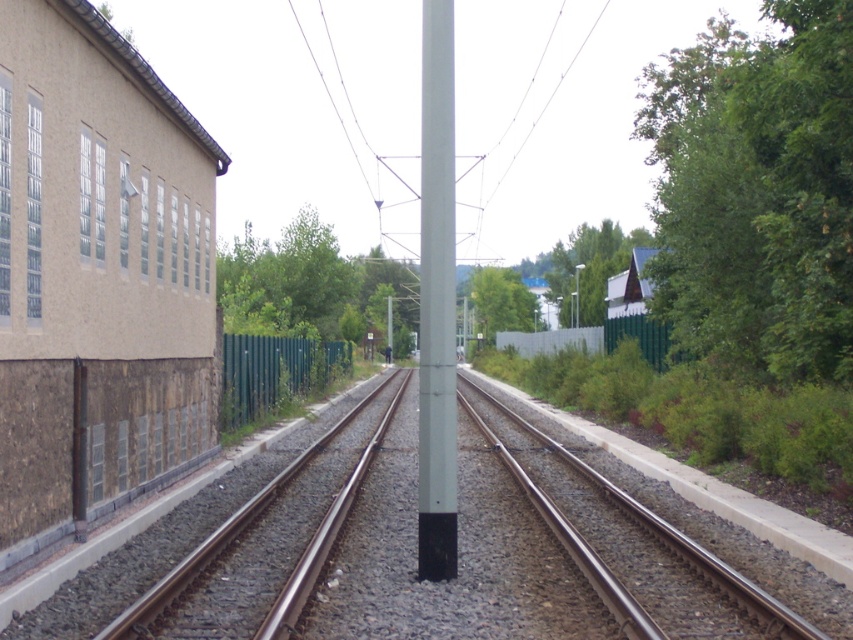
Is green leafy tree at upper center to the right of green leafy tree at center from the viewer's perspective?

Yes, green leafy tree at upper center is to the right of green leafy tree at center.

Which is more to the right, green leafy tree at upper center or green leafy tree at center?

Positioned to the right is green leafy tree at upper center.

Between point (570, 236) and point (525, 305), which one is positioned in front?

Point (525, 305) is more forward.

At what (x,y) coordinates should I click in order to perform the action: click on green leafy tree at upper center. Please return your answer as a coordinate pair (x, y). Looking at the image, I should click on (590, 266).

Is white glossy pole at center thinner than brown metal train track at center?

No, white glossy pole at center is not thinner than brown metal train track at center.

Is white glossy pole at center closer to the viewer compared to brown metal train track at center?

No, white glossy pole at center is behind brown metal train track at center.

Where is `white glossy pole at center`? This screenshot has width=853, height=640. white glossy pole at center is located at coordinates (436, 300).

From the picture: Can you confirm if metallic smooth train track at right is taller than green leafy tree at upper center?

No.

Is point (495, 403) behind point (636, 237)?

No, it is not.

Where is `metallic smooth train track at right`? The width and height of the screenshot is (853, 640). metallic smooth train track at right is located at coordinates (675, 540).